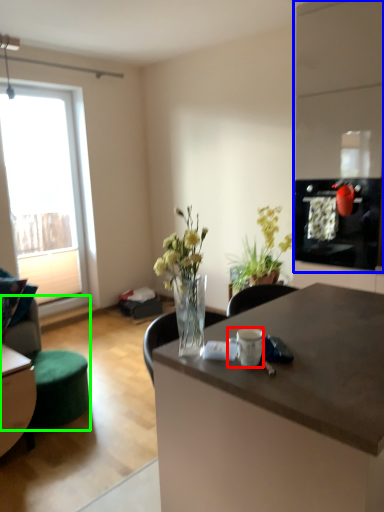
Question: Estimate the real-world distances between objects in this image. Which object is farther from coffee cup (highlighted by a red box), cabinetry (highlighted by a blue box) or swivel chair (highlighted by a green box)?

Choices:
 (A) cabinetry
 (B) swivel chair

Answer: (A)